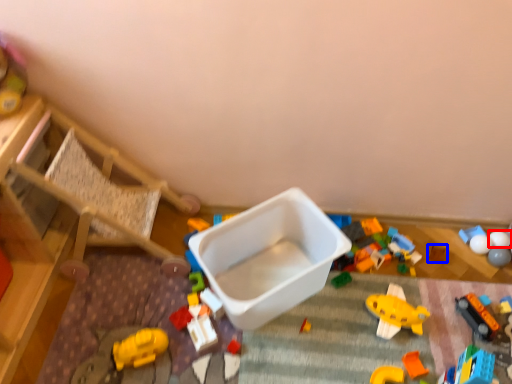
Question: Which object is closer to the camera taking this photo, toy (highlighted by a red box) or toy (highlighted by a blue box)?

Choices:
 (A) toy
 (B) toy

Answer: (A)